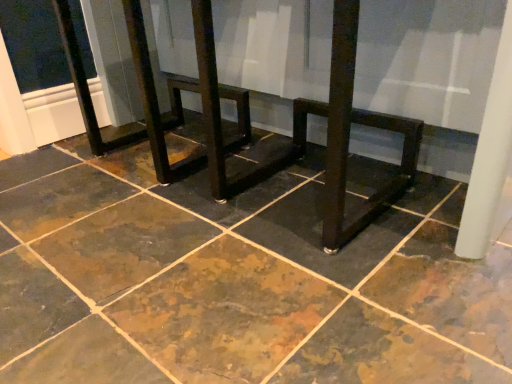
The height and width of the screenshot is (384, 512). Find the location of `marbled stone floor at center`. marbled stone floor at center is located at coordinates (234, 281).

Image resolution: width=512 pixels, height=384 pixels. Describe the element at coordinates (234, 281) in the screenshot. I see `marbled stone floor at center` at that location.

Describe the element at coordinates (306, 129) in the screenshot. I see `matte dark wood table at center` at that location.

Measure the distance between point (381, 203) and camera.

Point (381, 203) is 96.30 centimeters from camera.

Locate an element on the screen. The height and width of the screenshot is (384, 512). matte dark wood table at center is located at coordinates (306, 129).

The height and width of the screenshot is (384, 512). I want to click on marbled stone floor at center, so click(234, 281).

Between matte dark wood table at center and marbled stone floor at center, which one appears on the right side from the viewer's perspective?

matte dark wood table at center is more to the right.

Does matte dark wood table at center come behind marbled stone floor at center?

Yes, matte dark wood table at center is further from the camera.

Is point (373, 113) positioned after point (447, 357)?

Yes, it is behind point (447, 357).

From the image's perspective, is matte dark wood table at center on marbled stone floor at center?

Yes, from the image's perspective, matte dark wood table at center is on top of marbled stone floor at center.

From a real-world perspective, which is physically below, matte dark wood table at center or marbled stone floor at center?

From a 3D spatial view, marbled stone floor at center is below.

Considering the relative sizes of matte dark wood table at center and marbled stone floor at center in the image provided, is matte dark wood table at center wider than marbled stone floor at center?

Incorrect, the width of matte dark wood table at center does not surpass that of marbled stone floor at center.

In the scene shown: Considering the sizes of matte dark wood table at center and marbled stone floor at center in the image, is matte dark wood table at center taller or shorter than marbled stone floor at center?

Clearly, matte dark wood table at center is taller compared to marbled stone floor at center.

In terms of size, does matte dark wood table at center appear bigger or smaller than marbled stone floor at center?

In the image, matte dark wood table at center appears to be smaller than marbled stone floor at center.

Choose the correct answer: Is matte dark wood table at center inside marbled stone floor at center or outside it?

matte dark wood table at center is located beyond the bounds of marbled stone floor at center.

Are matte dark wood table at center and marbled stone floor at center beside each other?

No, matte dark wood table at center is not touching marbled stone floor at center.

Is matte dark wood table at center facing towards marbled stone floor at center?

No, matte dark wood table at center is not oriented towards marbled stone floor at center.

Identify the location of round table behind the marbled stone floor at center. Image resolution: width=512 pixels, height=384 pixels. (306, 129).

Considering the positions of objects marbled stone floor at center and matte dark wood table at center in the image provided, who is more to the left, marbled stone floor at center or matte dark wood table at center?

marbled stone floor at center is more to the left.

Which object is more forward, marbled stone floor at center or matte dark wood table at center?

marbled stone floor at center is closer to the camera.

Between point (61, 273) and point (332, 250), which one is positioned behind?

The point (332, 250) is more distant.

From the image's perspective, is marbled stone floor at center on matte dark wood table at center?

No, from the image's perspective, marbled stone floor at center is not on top of matte dark wood table at center.

From a real-world perspective, is marbled stone floor at center positioned above or below matte dark wood table at center?

Clearly, from a real-world perspective, marbled stone floor at center is below matte dark wood table at center.

Is marbled stone floor at center thinner than matte dark wood table at center?

No.

Between marbled stone floor at center and matte dark wood table at center, which one has less height?

Standing shorter between the two is marbled stone floor at center.

Does marbled stone floor at center have a smaller size compared to matte dark wood table at center?

No, marbled stone floor at center is not smaller than matte dark wood table at center.

Is marbled stone floor at center completely or partially outside of matte dark wood table at center?

Yes, marbled stone floor at center is outside of matte dark wood table at center.

Is marbled stone floor at center with matte dark wood table at center?

marbled stone floor at center and matte dark wood table at center are not in contact.

Is marbled stone floor at center facing away from matte dark wood table at center?

That's not correct — marbled stone floor at center is not looking away from matte dark wood table at center.

Can you tell me how much marbled stone floor at center and matte dark wood table at center differ in facing direction?

0.521 degrees.

The height and width of the screenshot is (384, 512). I want to click on round table above the marbled stone floor at center (from the image's perspective), so click(306, 129).

This screenshot has width=512, height=384. What are the coordinates of `round table above the marbled stone floor at center (from the image's perspective)` in the screenshot? It's located at (306, 129).

Find the location of a particular element. concrete located underneath the matte dark wood table at center (from a real-world perspective) is located at coordinates (234, 281).